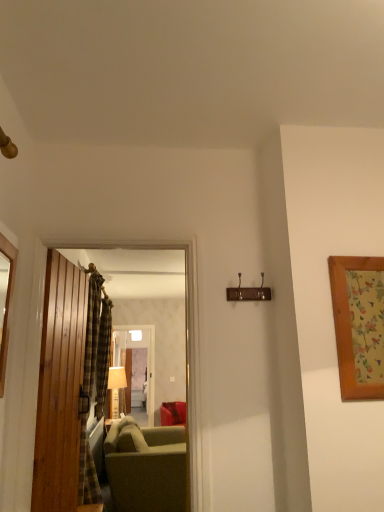
The image size is (384, 512). I want to click on velvet green couch at lower center, so click(x=146, y=467).

Where is `wooden mirror at left, which ranks as the second picture frame in right-to-left order`? The image size is (384, 512). wooden mirror at left, which ranks as the second picture frame in right-to-left order is located at coordinates (6, 303).

The width and height of the screenshot is (384, 512). Describe the element at coordinates (94, 380) in the screenshot. I see `plaid fabric curtain at left, the second curtain in the left-to-right sequence` at that location.

What do you see at coordinates (106, 384) in the screenshot? I see `wooden door at center, the first door from the right` at bounding box center [106, 384].

This screenshot has height=512, width=384. I want to click on velvet green couch at lower center, so [x=146, y=467].

Which is in front, point (151, 414) or point (114, 384)?

The point (114, 384) is more forward.

Is transparent glass door at center far from matte beige lamp at center?

No, transparent glass door at center is not far from matte beige lamp at center.

Considering the relative positions of transparent glass door at center and matte beige lamp at center in the image provided, is transparent glass door at center in front of matte beige lamp at center?

No.

Which object is further away from the camera, velvet green couch at lower center or matte beige lamp at center?

Positioned behind is matte beige lamp at center.

Is point (166, 508) closer to viewer compared to point (115, 403)?

Yes.

Can you confirm if velvet green couch at lower center is taller than matte beige lamp at center?

Correct, velvet green couch at lower center is much taller as matte beige lamp at center.

Which object is positioned more to the right, velvet green couch at lower center or matte beige lamp at center?

velvet green couch at lower center is more to the right.

From the picture: Could you tell me if plaid fabric curtain at left, the 1th curtain when ordered from right to left, is facing velvet green couch at lower center?

No.

From a real-world perspective, which is physically above, plaid fabric curtain at left, the second curtain in the left-to-right sequence, or velvet green couch at lower center?

plaid fabric curtain at left, the second curtain in the left-to-right sequence, is physically above.

Considering the sizes of objects plaid fabric curtain at left, the second curtain in the left-to-right sequence, and velvet green couch at lower center in the image provided, who is smaller, plaid fabric curtain at left, the second curtain in the left-to-right sequence, or velvet green couch at lower center?

Smaller between the two is plaid fabric curtain at left, the second curtain in the left-to-right sequence.

Is plaid fabric curtain at left, the 1th curtain when ordered from right to left, to the right of velvet green couch at lower center from the viewer's perspective?

No.

Considering the positions of objects wooden mirror at left, marked as the first picture frame in a left-to-right arrangement, and wooden door at center, the first door from the right, in the image provided, who is more to the left, wooden mirror at left, marked as the first picture frame in a left-to-right arrangement, or wooden door at center, the first door from the right,?

From the viewer's perspective, wooden mirror at left, marked as the first picture frame in a left-to-right arrangement, appears more on the left side.

Where is `the 1st door positioned below the wooden mirror at left, which ranks as the second picture frame in right-to-left order (from the image's perspective)`? This screenshot has height=512, width=384. the 1st door positioned below the wooden mirror at left, which ranks as the second picture frame in right-to-left order (from the image's perspective) is located at coordinates (106, 384).

Is wooden door at center, the first door from the right, surrounded by wooden mirror at left, marked as the first picture frame in a left-to-right arrangement?

No, wooden door at center, the first door from the right, is not a part of wooden mirror at left, marked as the first picture frame in a left-to-right arrangement.

From a real-world perspective, is wooden mirror at left, marked as the first picture frame in a left-to-right arrangement, on wooden door at center, which is the 2th door from left to right?

Indeed, from a real-world perspective, wooden mirror at left, marked as the first picture frame in a left-to-right arrangement, stands above wooden door at center, which is the 2th door from left to right.

Between wooden door at left, acting as the 1th door starting from the left, and wooden mirror at left, which ranks as the second picture frame in right-to-left order, which one has more height?

Standing taller between the two is wooden door at left, acting as the 1th door starting from the left.

Consider the image. From a real-world perspective, is wooden door at left, which is counted as the second door, starting from the right, physically above wooden mirror at left, which ranks as the second picture frame in right-to-left order?

No, from a real-world perspective, wooden door at left, which is counted as the second door, starting from the right, is not over wooden mirror at left, which ranks as the second picture frame in right-to-left order

Looking at the image, does wooden door at left, which is counted as the second door, starting from the right, seem bigger or smaller compared to wooden mirror at left, marked as the first picture frame in a left-to-right arrangement?

Clearly, wooden door at left, which is counted as the second door, starting from the right, is larger in size than wooden mirror at left, marked as the first picture frame in a left-to-right arrangement.

Is wooden door at left, acting as the 1th door starting from the left, wider or thinner than wooden mirror at left, marked as the first picture frame in a left-to-right arrangement?

wooden door at left, acting as the 1th door starting from the left, is wider than wooden mirror at left, marked as the first picture frame in a left-to-right arrangement.

Is wooden mirror at left, which ranks as the second picture frame in right-to-left order, next to plaid fabric curtain at left, the 1th curtain when ordered from right to left, and touching it?

No, wooden mirror at left, which ranks as the second picture frame in right-to-left order, is not beside plaid fabric curtain at left, the 1th curtain when ordered from right to left.

Is wooden mirror at left, marked as the first picture frame in a left-to-right arrangement, to the left of plaid fabric curtain at left, the 1th curtain when ordered from right to left, from the viewer's perspective?

In fact, wooden mirror at left, marked as the first picture frame in a left-to-right arrangement, is to the right of plaid fabric curtain at left, the 1th curtain when ordered from right to left.

Is point (0, 334) closer or farther from the camera than point (92, 458)?

Point (0, 334) is positioned closer to the camera compared to point (92, 458).

Is wooden mirror at left, which ranks as the second picture frame in right-to-left order, in front of or behind plaid fabric curtain at left, the 1th curtain when ordered from right to left, in the image?

wooden mirror at left, which ranks as the second picture frame in right-to-left order, is in front of plaid fabric curtain at left, the 1th curtain when ordered from right to left.

From the image's perspective, is plaid fabric curtain at left, which appears as the second curtain when viewed from the back, under wooden mirror at left, marked as the first picture frame in a left-to-right arrangement?

Yes, from the image's perspective, plaid fabric curtain at left, which appears as the second curtain when viewed from the back, is below wooden mirror at left, marked as the first picture frame in a left-to-right arrangement.

From a real-world perspective, is plaid fabric curtain at left, the second curtain in the left-to-right sequence, beneath wooden mirror at left, marked as the first picture frame in a left-to-right arrangement?

Indeed, from a real-world perspective, plaid fabric curtain at left, the second curtain in the left-to-right sequence, is positioned beneath wooden mirror at left, marked as the first picture frame in a left-to-right arrangement.

Looking at this image, does plaid fabric curtain at left, the second curtain in the left-to-right sequence, have a larger size compared to wooden mirror at left, marked as the first picture frame in a left-to-right arrangement?

Indeed, plaid fabric curtain at left, the second curtain in the left-to-right sequence, has a larger size compared to wooden mirror at left, marked as the first picture frame in a left-to-right arrangement.

You are a GUI agent. You are given a task and a screenshot of the screen. Output one action in this format:
    pyautogui.click(x=<x>, y=<y>)
    Task: Click on the glass door that appears above the matte beige lamp at center (from a real-world perspective)
    The width and height of the screenshot is (384, 512).
    Given the screenshot: What is the action you would take?
    pyautogui.click(x=148, y=365)

Find the location of `lamp above the velvet green couch at lower center (from the image's perspective)`. lamp above the velvet green couch at lower center (from the image's perspective) is located at coordinates (116, 388).

Looking at the image, which one is located closer to wooden door at left, which is counted as the second door, starting from the right, velvet green couch at lower center or wooden mirror at left, which ranks as the second picture frame in right-to-left order?

wooden mirror at left, which ranks as the second picture frame in right-to-left order, is closer to wooden door at left, which is counted as the second door, starting from the right.

Considering their positions, is wooden mirror at left, which ranks as the second picture frame in right-to-left order, positioned closer to wooden door at center, which is the 2th door from left to right, than matte beige lamp at center?

matte beige lamp at center.

Estimate the real-world distances between objects in this image. Which object is closer to transparent glass door at center, wooden door at center, the first door from the right, or wooden mirror at left, marked as the first picture frame in a left-to-right arrangement?

Based on the image, wooden door at center, the first door from the right, appears to be nearer to transparent glass door at center.

Estimate the real-world distances between objects in this image. Which object is further from wooden picture frame at right, arranged as the 1th picture frame when viewed from the right, wooden door at center, the first door from the right, or wooden mirror at left, marked as the first picture frame in a left-to-right arrangement?

wooden door at center, the first door from the right, is further to wooden picture frame at right, arranged as the 1th picture frame when viewed from the right.

Estimate the real-world distances between objects in this image. Which object is further from plaid fabric curtain at left, which appears as the second curtain when viewed from the back, plaid fabric curtain at left, acting as the second curtain starting from the front, or matte beige lamp at center?

Among the two, matte beige lamp at center is located further to plaid fabric curtain at left, which appears as the second curtain when viewed from the back.

Looking at the image, which one is located further to plaid fabric curtain at left, the second curtain in the left-to-right sequence, matte beige lamp at center or wooden door at center, the first door from the right?

The object further to plaid fabric curtain at left, the second curtain in the left-to-right sequence, is wooden door at center, the first door from the right.

In the scene shown: Looking at the image, which one is located further to wooden door at center, the first door from the right, plaid fabric curtain at left, which appears as the second curtain when viewed from the back, or matte beige lamp at center?

plaid fabric curtain at left, which appears as the second curtain when viewed from the back, lies further to wooden door at center, the first door from the right, than the other object.

Estimate the real-world distances between objects in this image. Which object is closer to wooden picture frame at right, arranged as the 1th picture frame when viewed from the right, wooden mirror at left, marked as the first picture frame in a left-to-right arrangement, or plaid fabric curtain at left, the second curtain in the left-to-right sequence?

Based on the image, wooden mirror at left, marked as the first picture frame in a left-to-right arrangement, appears to be nearer to wooden picture frame at right, arranged as the 1th picture frame when viewed from the right.

Where is `curtain between wooden door at left, which is counted as the second door, starting from the right, and plaid fabric curtain at left, acting as the second curtain starting from the front, in the front-back direction`? Image resolution: width=384 pixels, height=512 pixels. curtain between wooden door at left, which is counted as the second door, starting from the right, and plaid fabric curtain at left, acting as the second curtain starting from the front, in the front-back direction is located at coordinates [94, 380].

Find the location of a particular element. The height and width of the screenshot is (512, 384). studio couch between wooden door at center, which is the 2th door from left to right, and transparent glass door at center, along the z-axis is located at coordinates (146, 467).

The height and width of the screenshot is (512, 384). Find the location of `picture frame between wooden mirror at left, which ranks as the second picture frame in right-to-left order, and plaid fabric curtain at left, which appears as the second curtain when viewed from the back, along the z-axis`. picture frame between wooden mirror at left, which ranks as the second picture frame in right-to-left order, and plaid fabric curtain at left, which appears as the second curtain when viewed from the back, along the z-axis is located at coordinates (359, 325).

At what (x,y) coordinates should I click in order to perform the action: click on studio couch between wooden mirror at left, which ranks as the second picture frame in right-to-left order, and transparent glass door at center from front to back. Please return your answer as a coordinate pair (x, y). The height and width of the screenshot is (512, 384). Looking at the image, I should click on (146, 467).